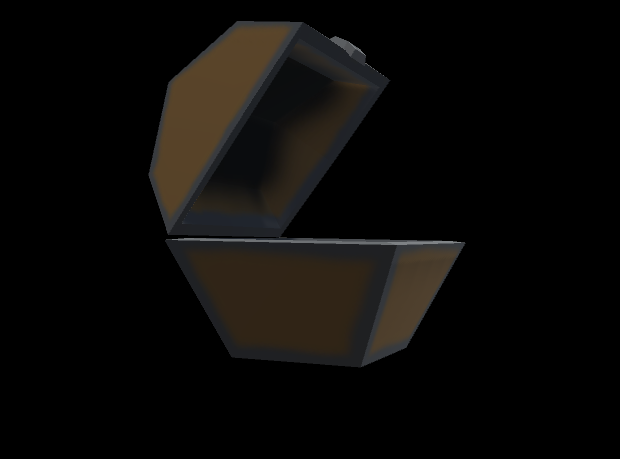
This screenshot has width=620, height=459. In order to click on chest handle in this screenshot , I will do `click(360, 51)`.